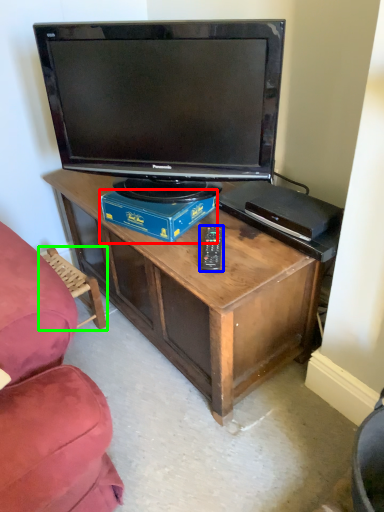
Question: Estimate the real-world distances between objects in this image. Which object is closer to box (highlighted by a red box), remote (highlighted by a blue box) or swivel chair (highlighted by a green box)?

Choices:
 (A) remote
 (B) swivel chair

Answer: (A)